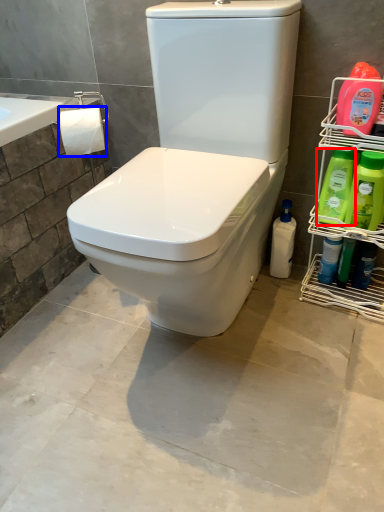
Question: Among these objects, which one is nearest to the camera, cleaning product (highlighted by a red box) or toilet paper (highlighted by a blue box)?

Choices:
 (A) cleaning product
 (B) toilet paper

Answer: (A)